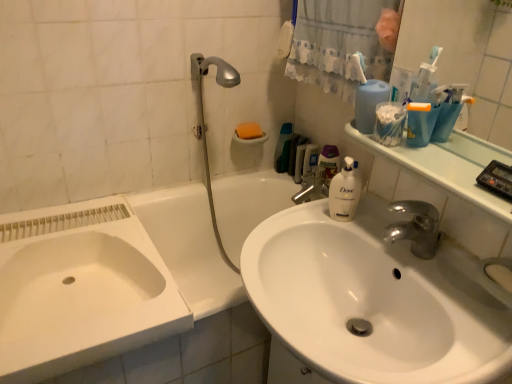
What do you see at coordinates (389, 123) in the screenshot?
I see `white plastic cotton swabs at upper right, positioned as the 3th mouthwash in left-to-right order` at bounding box center [389, 123].

Locate an element on the screen. This screenshot has height=384, width=512. white plastic cotton swabs at upper right, which is counted as the 3th mouthwash, starting from the back is located at coordinates (389, 123).

The width and height of the screenshot is (512, 384). Describe the element at coordinates (206, 126) in the screenshot. I see `silver metallic showerhead at upper center` at that location.

What is the approximate width of white glossy bathtub at center?

69.76 centimeters.

You are a GUI agent. You are given a task and a screenshot of the screen. Output one action in this format:
    pyautogui.click(x=<x>, y=<y>)
    Task: Click on the blue plastic container at upper right, the 1th cleaning product from the front
    
    Given the screenshot: What is the action you would take?
    pyautogui.click(x=369, y=103)

The height and width of the screenshot is (384, 512). Describe the element at coordinates (369, 103) in the screenshot. I see `blue plastic container at upper right, which is the 2th cleaning product from back to front` at that location.

The width and height of the screenshot is (512, 384). What are the coordinates of `orange sponge at upper center` in the screenshot? It's located at (249, 131).

This screenshot has width=512, height=384. I want to click on white fabric shower curtain at upper center, so click(x=338, y=44).

What do you see at coordinates (338, 44) in the screenshot? This screenshot has height=384, width=512. I see `white fabric shower curtain at upper center` at bounding box center [338, 44].

The height and width of the screenshot is (384, 512). I want to click on translucent plastic mouthwash at upper right, which is the 2th mouthwash from right to left, so click(x=311, y=158).

Does silver metallic showerhead at upper center appear on the left side of blue plastic container at upper right, which is the 2th cleaning product from back to front?

Correct, you'll find silver metallic showerhead at upper center to the left of blue plastic container at upper right, which is the 2th cleaning product from back to front.

Is point (234, 77) farther from viewer compared to point (361, 128)?

That is True.

Is silver metallic showerhead at upper center touching blue plastic container at upper right, which is the 2th cleaning product from back to front?

No, silver metallic showerhead at upper center is not touching blue plastic container at upper right, which is the 2th cleaning product from back to front.

Is the depth of silver metallic showerhead at upper center less than that of blue plastic container at upper right, which is the 2th cleaning product from back to front?

No, it is not.

Is silver metallic showerhead at upper center smaller than white glossy sink at center?

Yes.

Which is behind, point (202, 129) or point (272, 277)?

Point (202, 129)

Is there a large distance between silver metallic showerhead at upper center and white glossy sink at center?

silver metallic showerhead at upper center is actually quite close to white glossy sink at center.

Considering the sizes of silver metallic showerhead at upper center and white glossy sink at center in the image, is silver metallic showerhead at upper center wider or thinner than white glossy sink at center?

silver metallic showerhead at upper center is thinner than white glossy sink at center.

From a real-world perspective, is orange sponge at upper center physically below green plastic container at upper center, the first mouthwash positioned from the back?

No, from a real-world perspective, orange sponge at upper center is not under green plastic container at upper center, the first mouthwash positioned from the back.

Between point (244, 132) and point (287, 145), which one is positioned behind?

Positioned behind is point (287, 145).

Is orange sponge at upper center thinner than green plastic container at upper center, the first mouthwash positioned from the back?

Incorrect, the width of orange sponge at upper center is not less than that of green plastic container at upper center, the first mouthwash positioned from the back.

Relative to green plastic container at upper center, the 1th mouthwash viewed from the left, is orange sponge at upper center in front or behind?

Visually, orange sponge at upper center is located in front of green plastic container at upper center, the 1th mouthwash viewed from the left.

How different are the orientations of orange sponge at upper center and white glossy bathtub at center in degrees?

orange sponge at upper center and white glossy bathtub at center are facing 2.26 degrees away from each other.

Does orange sponge at upper center come behind white glossy bathtub at center?

Yes, orange sponge at upper center is behind white glossy bathtub at center.

Is orange sponge at upper center oriented towards white glossy bathtub at center?

No, orange sponge at upper center is not oriented towards white glossy bathtub at center.

Is orange sponge at upper center bigger or smaller than white glossy bathtub at center?

Clearly, orange sponge at upper center is smaller in size than white glossy bathtub at center.

Between white plastic cotton swabs at upper right, positioned as the 3th mouthwash in left-to-right order, and translucent plastic mouthwash at upper right, the 2th mouthwash viewed from the front, which one appears on the left side from the viewer's perspective?

Positioned to the left is translucent plastic mouthwash at upper right, the 2th mouthwash viewed from the front.

Based on the photo, considering the relative sizes of white plastic cotton swabs at upper right, which is counted as the 3th mouthwash, starting from the back, and translucent plastic mouthwash at upper right, acting as the second mouthwash starting from the back, in the image provided, is white plastic cotton swabs at upper right, which is counted as the 3th mouthwash, starting from the back, smaller than translucent plastic mouthwash at upper right, acting as the second mouthwash starting from the back,?

Yes.

Are white plastic cotton swabs at upper right, which is counted as the 3th mouthwash, starting from the back, and translucent plastic mouthwash at upper right, marked as the second mouthwash in a left-to-right arrangement, located far from each other?

No, white plastic cotton swabs at upper right, which is counted as the 3th mouthwash, starting from the back, is in close proximity to translucent plastic mouthwash at upper right, marked as the second mouthwash in a left-to-right arrangement.

Is point (396, 127) closer or farther from the camera than point (314, 166)?

Point (396, 127) is closer to the camera than point (314, 166).

Which object is positioned more to the left, white glossy bottle at upper center, marked as the second cleaning product in a front-to-back arrangement, or white fabric shower curtain at upper center?

white fabric shower curtain at upper center.

From the image's perspective, between white glossy bottle at upper center, acting as the 1th cleaning product starting from the back, and white fabric shower curtain at upper center, which one is located above?

white fabric shower curtain at upper center appears higher in the image.

Is white glossy bottle at upper center, acting as the 1th cleaning product starting from the back, not close to white fabric shower curtain at upper center?

Actually, white glossy bottle at upper center, acting as the 1th cleaning product starting from the back, and white fabric shower curtain at upper center are a little close together.

Considering the sizes of white glossy bottle at upper center, acting as the 1th cleaning product starting from the back, and white fabric shower curtain at upper center in the image, is white glossy bottle at upper center, acting as the 1th cleaning product starting from the back, bigger or smaller than white fabric shower curtain at upper center?

white glossy bottle at upper center, acting as the 1th cleaning product starting from the back, is smaller than white fabric shower curtain at upper center.

Between translucent plastic mouthwash at upper right, the 2th mouthwash viewed from the front, and green plastic container at upper center, placed as the 3th mouthwash when sorted from front to back, which one is positioned in front?

translucent plastic mouthwash at upper right, the 2th mouthwash viewed from the front, is in front.

Is there a large distance between translucent plastic mouthwash at upper right, acting as the second mouthwash starting from the back, and green plastic container at upper center, which appears as the 3th mouthwash when viewed from the right?

That's not correct — translucent plastic mouthwash at upper right, acting as the second mouthwash starting from the back, is a little close to green plastic container at upper center, which appears as the 3th mouthwash when viewed from the right.

Which is correct: translucent plastic mouthwash at upper right, which is the 2th mouthwash from right to left, is inside green plastic container at upper center, the 1th mouthwash viewed from the left, or outside of it?

translucent plastic mouthwash at upper right, which is the 2th mouthwash from right to left, is not enclosed by green plastic container at upper center, the 1th mouthwash viewed from the left.

Is translucent plastic mouthwash at upper right, marked as the second mouthwash in a left-to-right arrangement, to the right of green plastic container at upper center, the 1th mouthwash viewed from the left, from the viewer's perspective?

Correct, you'll find translucent plastic mouthwash at upper right, marked as the second mouthwash in a left-to-right arrangement, to the right of green plastic container at upper center, the 1th mouthwash viewed from the left.

Identify the location of cleaning product above the silver metallic showerhead at upper center (from a real-world perspective). (369, 103).

At what (x,y) coordinates should I click in order to perform the action: click on plumbing fixture on the left of white glossy sink at center. Please return your answer as a coordinate pair (x, y). This screenshot has width=512, height=384. Looking at the image, I should click on (206, 126).

Based on their spatial positions, is orange sponge at upper center or white glossy bottle at upper center, acting as the 1th cleaning product starting from the back, further from white glossy bathtub at center?

The object further to white glossy bathtub at center is white glossy bottle at upper center, acting as the 1th cleaning product starting from the back.

Looking at the image, which one is located further to white glossy bottle at upper center, acting as the 1th cleaning product starting from the back, white fabric shower curtain at upper center or orange sponge at upper center?

The object further to white glossy bottle at upper center, acting as the 1th cleaning product starting from the back, is white fabric shower curtain at upper center.

Which object lies nearer to the anchor point white glossy bottle at upper center, marked as the second cleaning product in a front-to-back arrangement, white glossy bathtub at center or white fabric shower curtain at upper center?

white fabric shower curtain at upper center is closer to white glossy bottle at upper center, marked as the second cleaning product in a front-to-back arrangement.

In the scene shown: Considering their positions, is white glossy bathtub at center positioned closer to green plastic container at upper center, placed as the 3th mouthwash when sorted from front to back, than white fabric shower curtain at upper center?

Among the two, white fabric shower curtain at upper center is located nearer to green plastic container at upper center, placed as the 3th mouthwash when sorted from front to back.

Looking at the image, which one is located further to white glossy bottle at upper center, marked as the second cleaning product in a front-to-back arrangement, white plastic cotton swabs at upper right, which is the 1th mouthwash in front-to-back order, or green plastic container at upper center, the first mouthwash positioned from the back?

white plastic cotton swabs at upper right, which is the 1th mouthwash in front-to-back order, lies further to white glossy bottle at upper center, marked as the second cleaning product in a front-to-back arrangement, than the other object.

Based on their spatial positions, is translucent plastic mouthwash at upper right, which is the 2th mouthwash from right to left, or green plastic container at upper center, which appears as the 3th mouthwash when viewed from the right, further from white glossy sink at center?

Among the two, green plastic container at upper center, which appears as the 3th mouthwash when viewed from the right, is located further to white glossy sink at center.

Which object lies nearer to the anchor point white fabric shower curtain at upper center, translucent plastic mouthwash at upper right, the 2th mouthwash viewed from the front, or orange sponge at upper center?

translucent plastic mouthwash at upper right, the 2th mouthwash viewed from the front, is closer to white fabric shower curtain at upper center.

Looking at the image, which one is located closer to silver metallic showerhead at upper center, white glossy bottle at upper center, acting as the 1th cleaning product starting from the back, or blue plastic container at upper right, the 1th cleaning product from the front?

Among the two, white glossy bottle at upper center, acting as the 1th cleaning product starting from the back, is located nearer to silver metallic showerhead at upper center.

Where is `cleaning product positioned between silver metallic showerhead at upper center and green plastic container at upper center, the first mouthwash positioned from the back, from near to far`? The width and height of the screenshot is (512, 384). cleaning product positioned between silver metallic showerhead at upper center and green plastic container at upper center, the first mouthwash positioned from the back, from near to far is located at coordinates (329, 162).

Locate an element on the screen. soap between white plastic cotton swabs at upper right, which is counted as the first mouthwash, starting from the right, and white glossy bottle at upper center, marked as the second cleaning product in a front-to-back arrangement, in the front-back direction is located at coordinates (249, 131).

The image size is (512, 384). I want to click on mouthwash located between silver metallic showerhead at upper center and green plastic container at upper center, which appears as the 3th mouthwash when viewed from the right, in the depth direction, so click(x=311, y=158).

Identify the location of plumbing fixture between white glossy sink at center and green plastic container at upper center, the first mouthwash positioned from the back, along the z-axis. The image size is (512, 384). (206, 126).